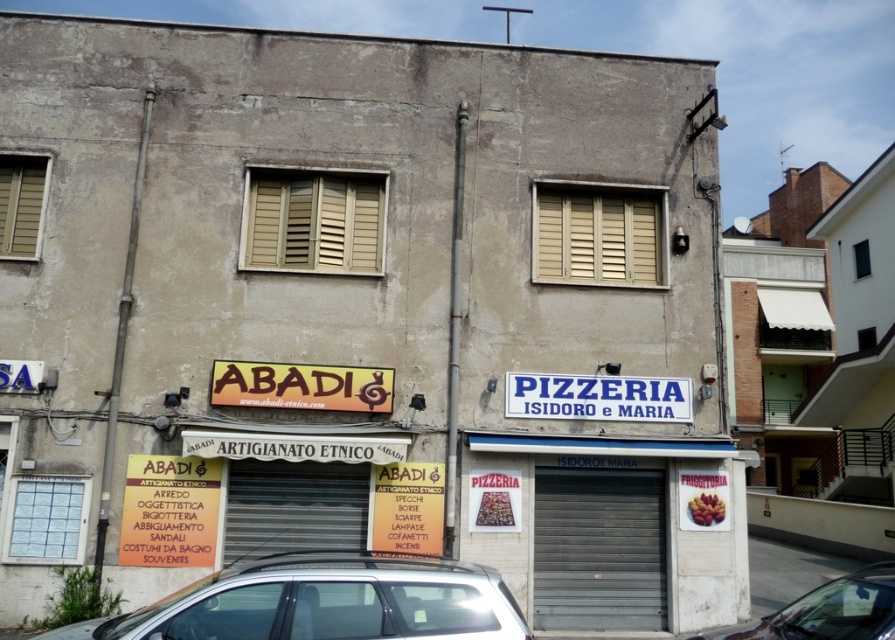
Question: Which of these objects is positioned farthest from the gray metallic shutter at lower center?

Choices:
 (A) beige wood shutters at center
 (B) beige wooden shutters at center
 (C) white paperboard at lower left
 (D) metallic silver car at lower right

Answer: (C)

Question: Is black matte shutter at center closer to camera compared to metallic silver car at lower right?

Choices:
 (A) no
 (B) yes

Answer: (A)

Question: Does beige wood shutters at center have a larger size compared to metallic silver car at lower right?

Choices:
 (A) no
 (B) yes

Answer: (B)

Question: Can you confirm if beige wood shutters at center is thinner than metallic silver car at lower right?

Choices:
 (A) no
 (B) yes

Answer: (A)

Question: Based on their relative distances, which object is nearer to the beige wooden shutter at left?

Choices:
 (A) black matte shutter at center
 (B) beige wooden shutters at center
 (C) gray metallic shutter at lower center
 (D) beige wood shutters at center

Answer: (B)

Question: Based on their relative distances, which object is farther from the beige wooden shutters at center?

Choices:
 (A) white paperboard at lower left
 (B) gray metallic shutter at lower center
 (C) metallic silver car at lower right
 (D) metallic silver car at lower center

Answer: (C)